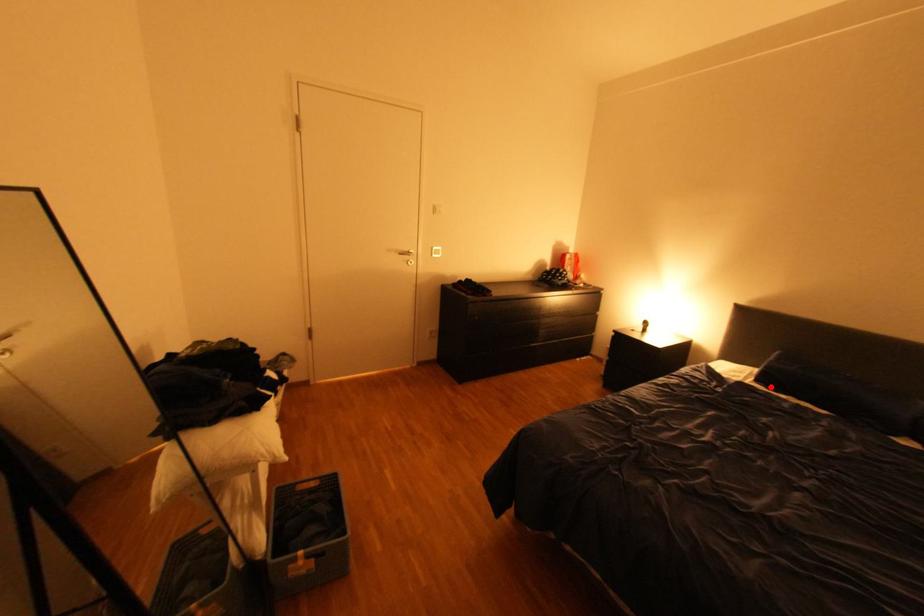
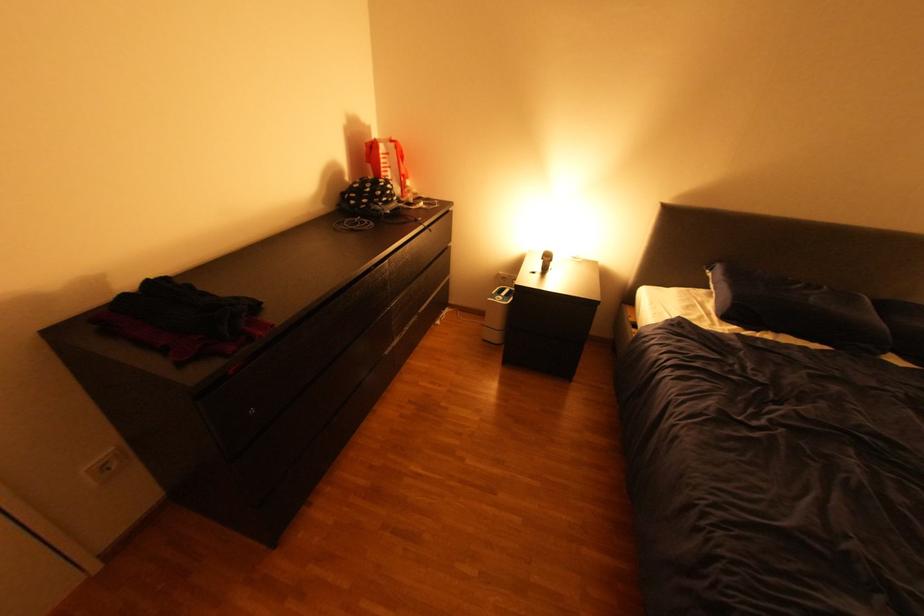
Locate, in the second image, the point that corresponds to the highlighted location in the first image.

(745, 326)